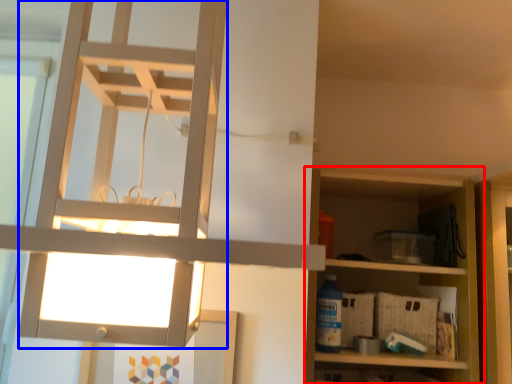
Question: Which object is closer to the camera taking this photo, shelf (highlighted by a red box) or lamp (highlighted by a blue box)?

Choices:
 (A) shelf
 (B) lamp

Answer: (B)